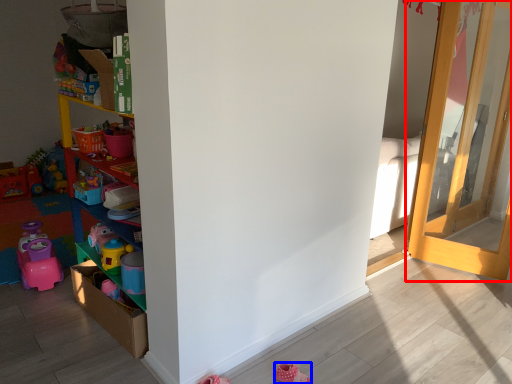
Question: Which object is closer to the camera taking this photo, door (highlighted by a red box) or shoe (highlighted by a blue box)?

Choices:
 (A) door
 (B) shoe

Answer: (B)